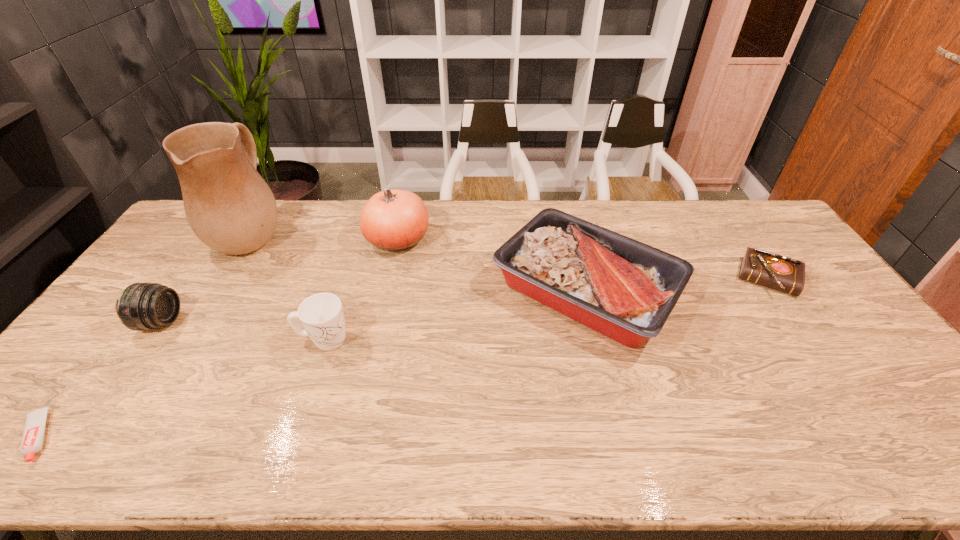
At what (x,y) coordinates should I click in order to perform the action: click on vacant space positioned 0.330m at the front element of the telephoto lens. Please return your answer as a coordinate pair (x, y). The width and height of the screenshot is (960, 540). Looking at the image, I should click on (295, 322).

This screenshot has width=960, height=540. I want to click on vacant area situated on the side of the mug with the handle, so click(471, 340).

Identify the location of free space located on the back of the second shortest object. (716, 202).

Where is `cream pitcher that is at the far edge`? cream pitcher that is at the far edge is located at coordinates (230, 208).

Locate an element on the screen. Image resolution: width=960 pixels, height=540 pixels. pumpkin that is at the far edge is located at coordinates (394, 220).

Locate an element on the screen. Image resolution: width=960 pixels, height=540 pixels. tray that is at the far edge is located at coordinates (624, 289).

At what (x,y) coordinates should I click in order to perform the action: click on cream pitcher located in the left edge section of the desktop. Please return your answer as a coordinate pair (x, y). The height and width of the screenshot is (540, 960). Looking at the image, I should click on (230, 208).

Find the location of `telephoto lens that is at the left edge`. telephoto lens that is at the left edge is located at coordinates (142, 306).

Where is `object positioned at the right edge`? object positioned at the right edge is located at coordinates (781, 273).

Where is `object situated at the far left corner`? object situated at the far left corner is located at coordinates (230, 208).